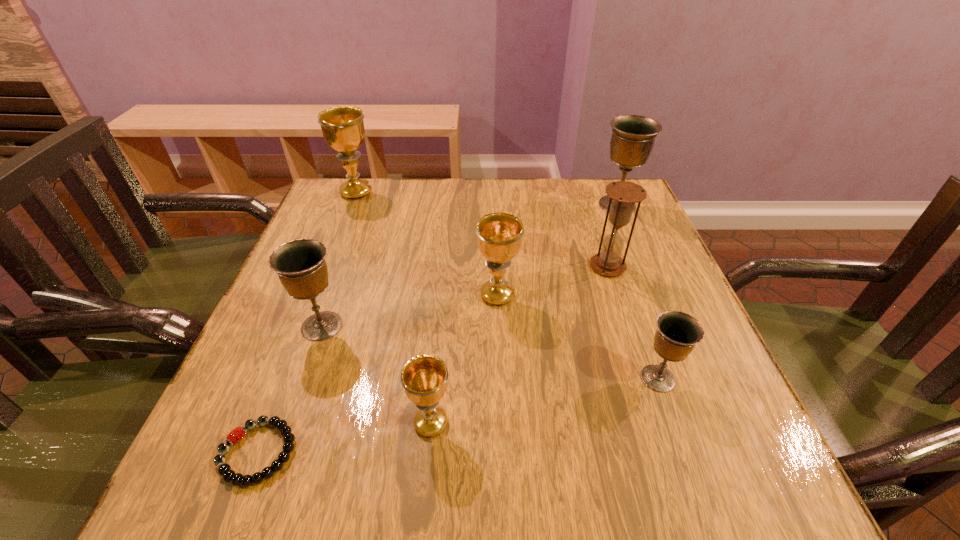
The width and height of the screenshot is (960, 540). In order to click on free space at the far edge of the desktop in this screenshot , I will do `click(386, 186)`.

At what (x,y) coordinates should I click in order to perform the action: click on free location at the near edge of the desktop. Please return your answer as a coordinate pair (x, y). The width and height of the screenshot is (960, 540). Looking at the image, I should click on (336, 492).

In order to click on free space at the left edge in this screenshot , I will do `click(291, 396)`.

Locate an element on the screen. The height and width of the screenshot is (540, 960). vacant space at the right edge is located at coordinates click(x=594, y=227).

You are a GUI agent. You are given a task and a screenshot of the screen. Output one action in this format:
    pyautogui.click(x=<x>, y=<y>)
    Task: Click on the vacant area at the far left corner of the desktop
    This screenshot has width=960, height=540.
    Given the screenshot: What is the action you would take?
    pyautogui.click(x=336, y=193)

Identify the location of free point between the brown hourglass and the third chalice from right to left. This screenshot has width=960, height=540. (553, 281).

Where is `vacant area that lies between the smallest gold chalice and the fourth chalice from left to right`? vacant area that lies between the smallest gold chalice and the fourth chalice from left to right is located at coordinates pyautogui.click(x=465, y=359).

Where is `free space between the farthest bronze chalice and the shortest object`? free space between the farthest bronze chalice and the shortest object is located at coordinates (438, 329).

At what (x,y) coordinates should I click in order to perform the action: click on vacant area that lies between the second nearest gold chalice and the fifth farthest chalice. Please return your answer as a coordinate pair (x, y). The width and height of the screenshot is (960, 540). Looking at the image, I should click on (578, 336).

Identify the location of free space between the farthest gold chalice and the nearest chalice. (394, 308).